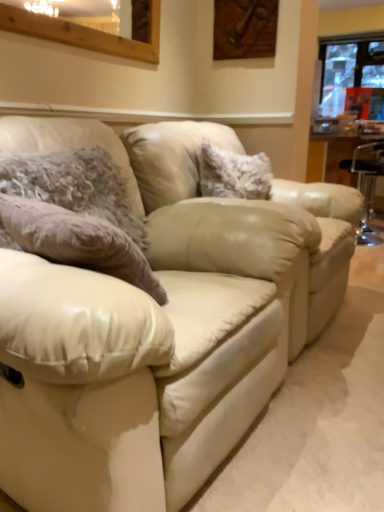
Question: Is matte cream leather couch at center located outside wooden frame at upper left, which is counted as the 2th window, starting from the top?

Choices:
 (A) no
 (B) yes

Answer: (B)

Question: Is matte cream leather couch at center placed right next to wooden frame at upper left, positioned as the 1th window in front-to-back order?

Choices:
 (A) yes
 (B) no

Answer: (B)

Question: Considering the relative sizes of matte cream leather couch at center and wooden frame at upper left, positioned as the 1th window in front-to-back order, in the image provided, is matte cream leather couch at center taller than wooden frame at upper left, positioned as the 1th window in front-to-back order,?

Choices:
 (A) no
 (B) yes

Answer: (B)

Question: Considering the relative positions of matte cream leather couch at center and wooden frame at upper left, which is counted as the 2th window, starting from the top, in the image provided, is matte cream leather couch at center in front of wooden frame at upper left, which is counted as the 2th window, starting from the top,?

Choices:
 (A) no
 (B) yes

Answer: (B)

Question: From the image's perspective, is matte cream leather couch at center over wooden frame at upper left, marked as the second window in a right-to-left arrangement?

Choices:
 (A) no
 (B) yes

Answer: (A)

Question: Is wooden frame at upper left, marked as the second window in a right-to-left arrangement, at the back of matte cream leather couch at center?

Choices:
 (A) no
 (B) yes

Answer: (A)

Question: Can you confirm if wooden frame at upper left, marked as the second window in a right-to-left arrangement, is thinner than transparent plastic bar stool at right?

Choices:
 (A) no
 (B) yes

Answer: (B)

Question: Does wooden frame at upper left, which is counted as the 2th window, starting from the top, contain transparent plastic bar stool at right?

Choices:
 (A) yes
 (B) no

Answer: (B)

Question: Can you confirm if wooden frame at upper left, which is counted as the 2th window, starting from the top, is bigger than transparent plastic bar stool at right?

Choices:
 (A) yes
 (B) no

Answer: (B)

Question: Does wooden frame at upper left, positioned as the 1th window in front-to-back order, come in front of transparent plastic bar stool at right?

Choices:
 (A) no
 (B) yes

Answer: (B)

Question: Is wooden frame at upper left, marked as the second window in a right-to-left arrangement, to the left of transparent plastic bar stool at right from the viewer's perspective?

Choices:
 (A) yes
 (B) no

Answer: (A)

Question: From the image's perspective, is wooden frame at upper left, marked as the second window in a right-to-left arrangement, beneath transparent plastic bar stool at right?

Choices:
 (A) no
 (B) yes

Answer: (A)

Question: From a real-world perspective, is matte cream leather couch at center located higher than fuzzy fabric pillow at center, which ranks as the second pillow in left-to-right order?

Choices:
 (A) yes
 (B) no

Answer: (B)